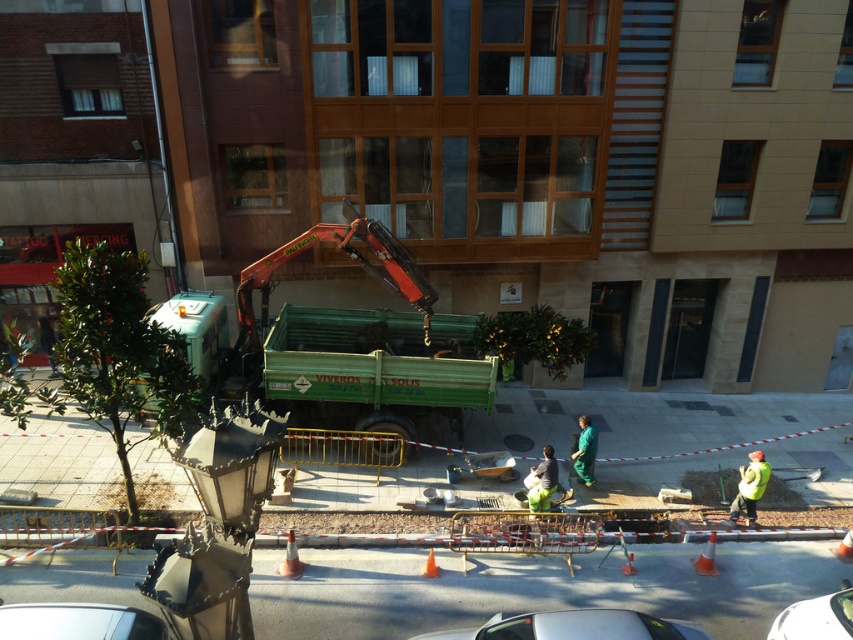
You are standing on the balcony looking at the construction site. There is an orange traffic cone at lower center. Where would you look to find the crane arm of the green truck? Please answer with coordinates in the format of x,y where x and y are between 0 and 1. The coordinate system is such that the bottom left corner is 0,0 and the top right corner is 1,1. The orange traffic cone is at point (706, 557). The crane arm is attached to the truck which is in the middle ground. The truck is labeled VIVEROS.

The crane arm is at 0.5, 0.4 because the green truck with crane arm is in the middle ground, so its crane arm would be positioned centrally below the traffic cone.

Consider the image. You are standing on the balcony looking at the construction site. You see a white glossy car at lower right and a green fabric worker at center. Which object is located to the right of the other?

The white glossy car at lower right is positioned on the right side of green fabric worker at center, so the white glossy car is to the right of the green fabric worker.

You are a delivery driver trying to navigate through the construction area shown in the image. You see the orange traffic cone at lower center and the orange plastic cone at lower center. Which cone should you avoid driving over if you want to ensure you don not damage your vehicle?

You should avoid driving over the orange traffic cone at lower center because it might be wider than the orange plastic cone at lower center, which could cause more damage to your vehicle.